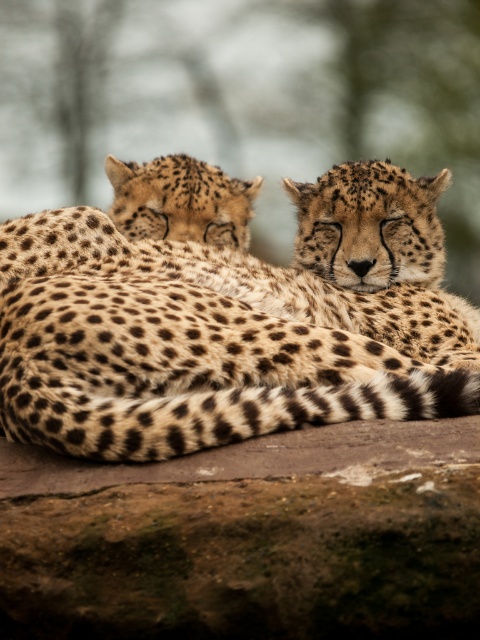
Is the position of spotted fur cheetah at center more distant than that of spotted fur cheetah at upper left?

No, spotted fur cheetah at center is closer to the viewer.

Can you confirm if spotted fur cheetah at center is positioned to the right of spotted fur cheetah at upper left?

Indeed, spotted fur cheetah at center is positioned on the right side of spotted fur cheetah at upper left.

Between point (347, 189) and point (213, 205), which one is positioned behind?

The point (213, 205) is more distant.

Identify the location of spotted fur cheetah at center. The image size is (480, 640). (231, 324).

Can you confirm if brown rough boulder at lower center is taller than spotted fur cheetah at upper left?

No, brown rough boulder at lower center is not taller than spotted fur cheetah at upper left.

Does point (347, 612) lie behind point (201, 172)?

No, it is not.

Find the location of a particular element. The image size is (480, 640). brown rough boulder at lower center is located at coordinates (249, 538).

Who is higher up, spotted fur cheetah at center or brown rough boulder at lower center?

spotted fur cheetah at center

Does spotted fur cheetah at center have a lesser width compared to brown rough boulder at lower center?

In fact, spotted fur cheetah at center might be wider than brown rough boulder at lower center.

Locate an element on the screen. This screenshot has width=480, height=640. spotted fur cheetah at center is located at coordinates (231, 324).